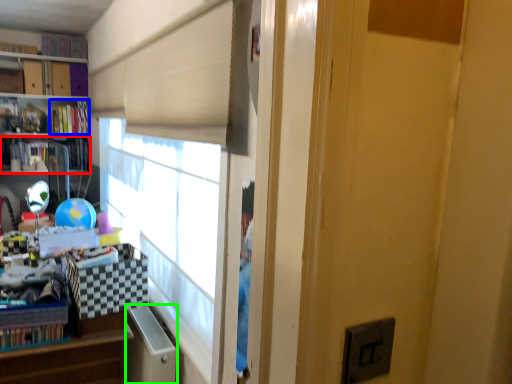
Question: Based on their relative distances, which object is farther from book (highlighted by a red box)? Choose from book (highlighted by a blue box) and file cabinet (highlighted by a green box).

Choices:
 (A) book
 (B) file cabinet

Answer: (B)